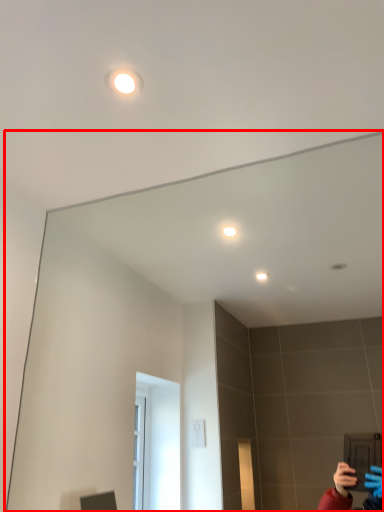
Question: From the image's perspective, where is mirror (annotated by the red box) located relative to light?

Choices:
 (A) above
 (B) below

Answer: (B)